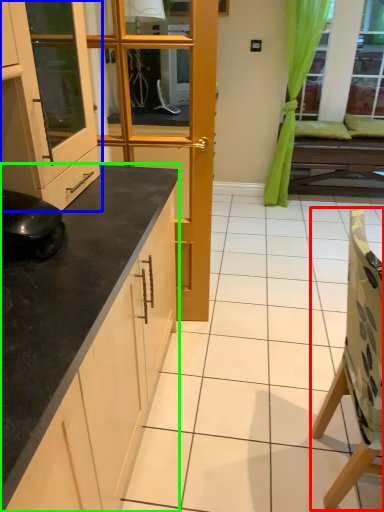
Question: Based on their relative distances, which object is farther from chair (highlighted by a red box)? Choose from cabinetry (highlighted by a blue box) and countertop (highlighted by a green box).

Choices:
 (A) cabinetry
 (B) countertop

Answer: (A)